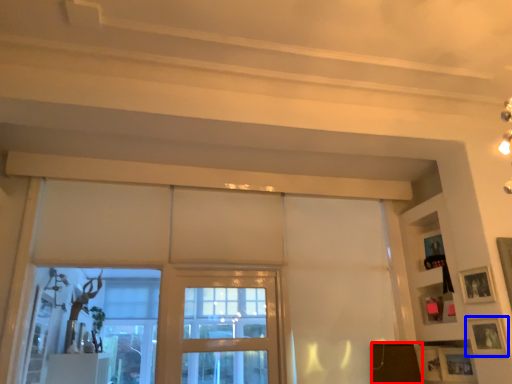
Question: Which object appears closest to the camera in this image, furniture (highlighted by a red box) or picture frame (highlighted by a blue box)?

Choices:
 (A) furniture
 (B) picture frame

Answer: (B)